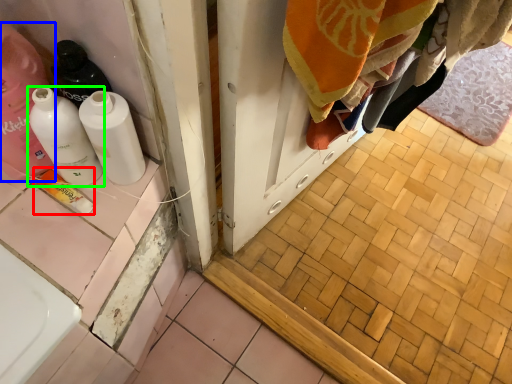
Question: Considering the real-world distances, which object is farthest from product (highlighted by a red box)? cleaning product (highlighted by a blue box) or bottle (highlighted by a green box)?

Choices:
 (A) cleaning product
 (B) bottle

Answer: (A)